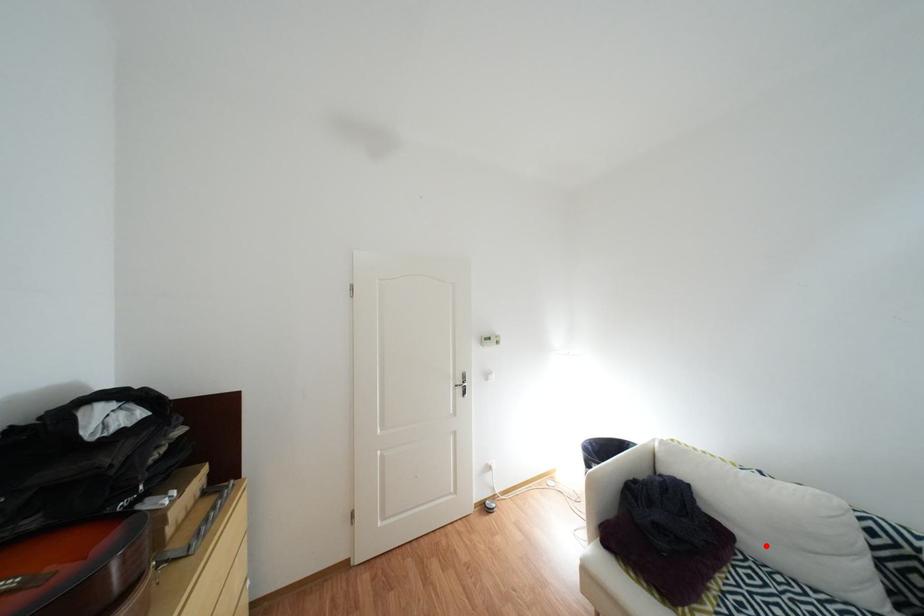
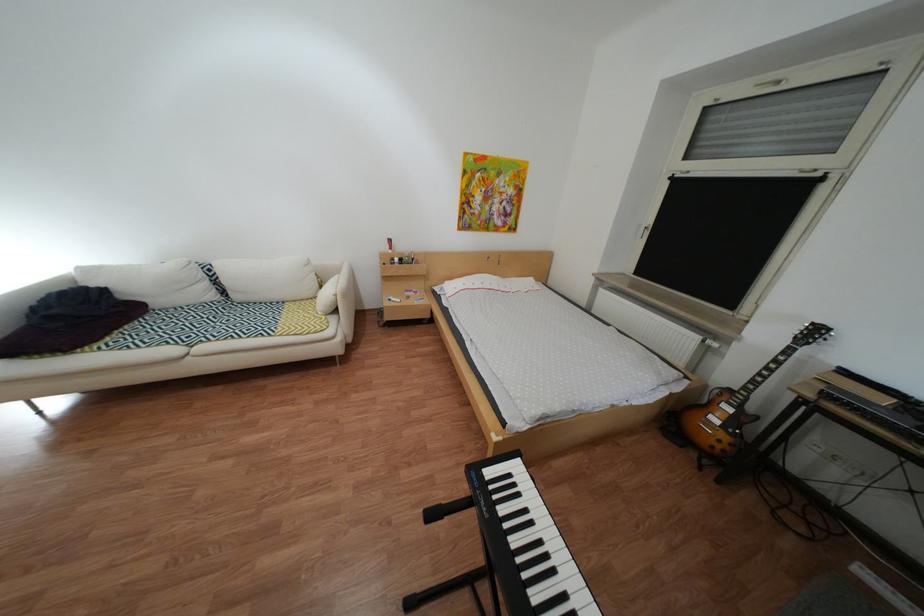
Question: I am providing you with two images of the same scene from different viewpoints. A red point is marked on the first image. Is the red point's position out of view in image 2?

Choices:
 (A) Yes
 (B) No

Answer: (B)